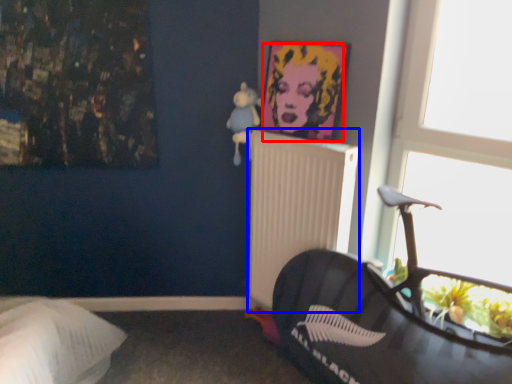
Question: Which point is closer to the camera, person (highlighted by a red box) or radiator (highlighted by a blue box)?

Choices:
 (A) person
 (B) radiator

Answer: (A)